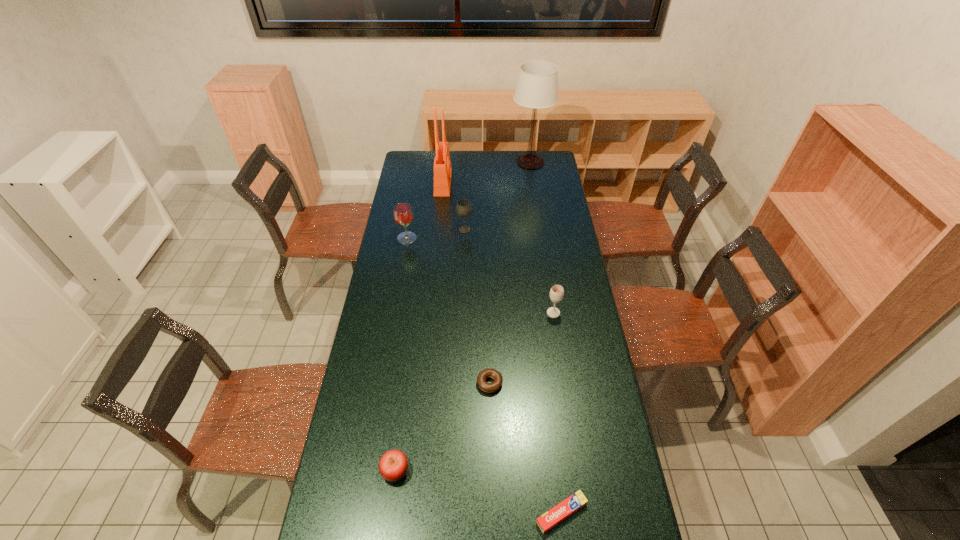
You are a GUI agent. You are given a task and a screenshot of the screen. Output one action in this format:
    pyautogui.click(x=<x>, y=<y>)
    Task: Click on the free location that satisfies the following two spatial constraints: 1. above the cylindrical shade of the fourth nearest object; 2. on the right side of the table lamp
    This screenshot has width=960, height=540.
    Given the screenshot: What is the action you would take?
    pyautogui.click(x=552, y=313)